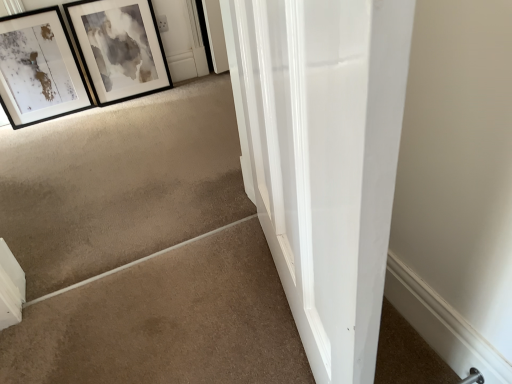
Question: Considering their positions, is beige carpet at lower left located in front of or behind matte black picture frame at upper left, which is the 2th picture frame in right-to-left order?

Choices:
 (A) behind
 (B) front

Answer: (B)

Question: Is beige carpet at lower left spatially inside matte black picture frame at upper left, which is the first picture frame from left to right, or outside of it?

Choices:
 (A) outside
 (B) inside

Answer: (A)

Question: Which object is the closest to the matte black picture frame at upper left, which is the first picture frame from left to right?

Choices:
 (A) black matte picture frame at upper left, which is counted as the first picture frame, starting from the right
 (B) beige carpet at lower left

Answer: (A)

Question: Which of these objects is positioned farthest from the matte black picture frame at upper left, which is the first picture frame from left to right?

Choices:
 (A) black matte picture frame at upper left, marked as the second picture frame in a left-to-right arrangement
 (B) beige carpet at lower left

Answer: (B)